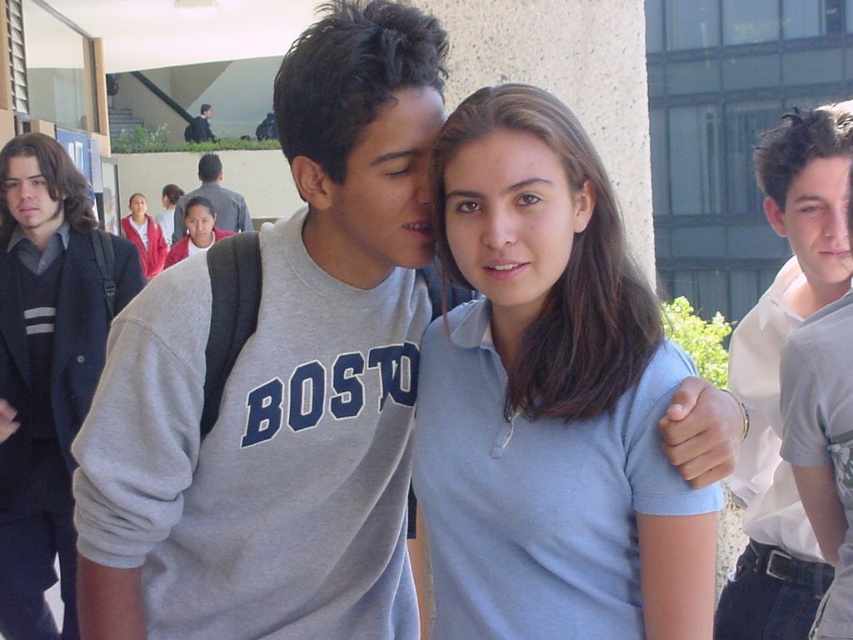
You are a photographer trying to capture the two people in the scene. You notice the dark gray sweater at left and the dark gray backpack at upper left. Which object is closer to the center of the image?

The dark gray sweater at left is positioned on the right side of the dark gray backpack at upper left, meaning the sweater is closer to the center than the backpack.

You are a photographer trying to capture a photo of the dark gray sweater at left and the dark gray backpack at upper left. Given that your camera can only focus on objects within a 50 feet distance range, will both objects be in focus?

The dark gray sweater at left and dark gray backpack at upper left are 69.99 feet apart, so the distance between them exceeds the camera focus range of 50 feet. Therefore, both objects cannot be in focus simultaneously.

You are a photographer trying to capture a wide shot of the scene. The matte red hoodie at upper left and the dark gray backpack at upper left are both in the frame. Which object appears narrower in the photo?

The matte red hoodie at upper left appears narrower than the dark gray backpack at upper left because it has a lesser width compared to the dark gray backpack at upper left.